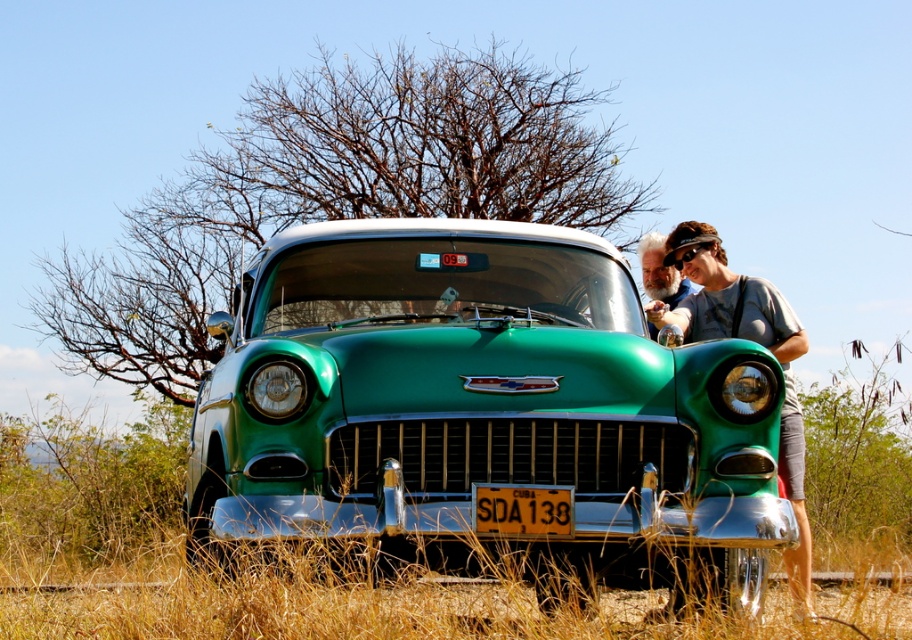
You are a photographer planning to take a group photo of the matte gray shirt at right and the bearded man at center. The camera frame can only accommodate objects up to the width of the wider of the two. Which object determines the minimum required frame width?

The matte gray shirt at right might be wider than bearded man at center, so the minimum required frame width should be based on the width of the matte gray shirt at right to ensure both fit.

You are a photographer trying to capture the green shiny car at center and the yellow plastic license plate at center in a single shot. Can you ensure both are in focus if you focus on the car?

The green shiny car at center is in front of the yellow plastic license plate at center, so focusing on the car will keep it sharp while the license plate may be slightly out of focus. Adjust your camera settings or move closer to ensure both are in focus.

You are a photographer trying to capture a clear photo of the green shiny car at center and the bearded man at center. Since both are at the center, which one is closer to you?

The green shiny car at center is in front of the bearded man at center, so the green shiny car at center is closer to you.